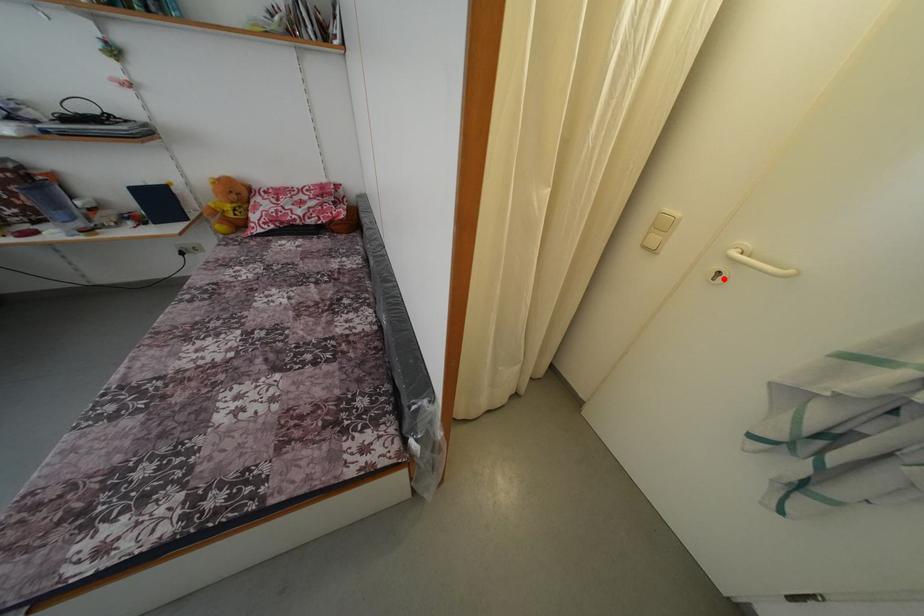
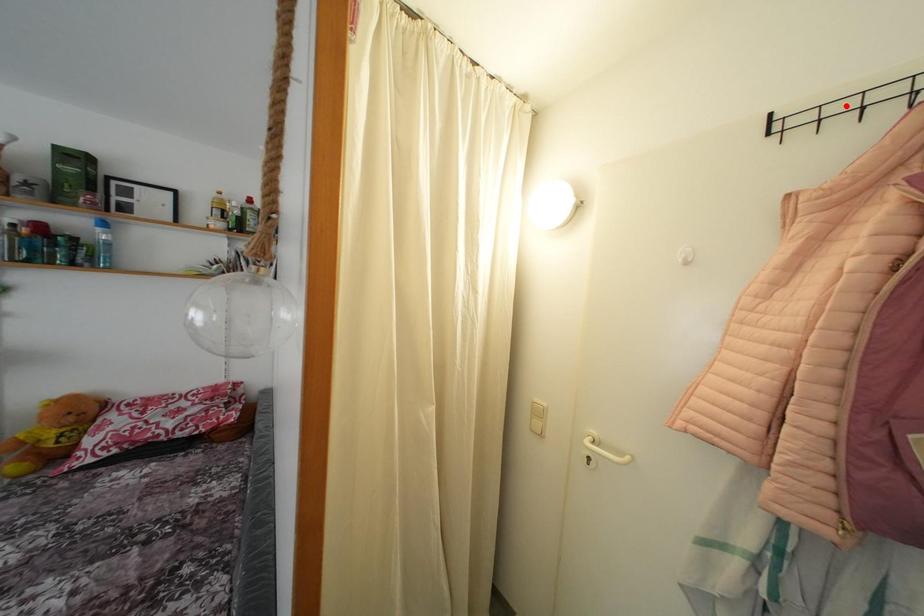
I am providing you with two images of the same scene from different viewpoints. A red point is marked on the first image and another point is marked on the second image. Do the highlighted points in image1 and image2 indicate the same real-world spot?

No